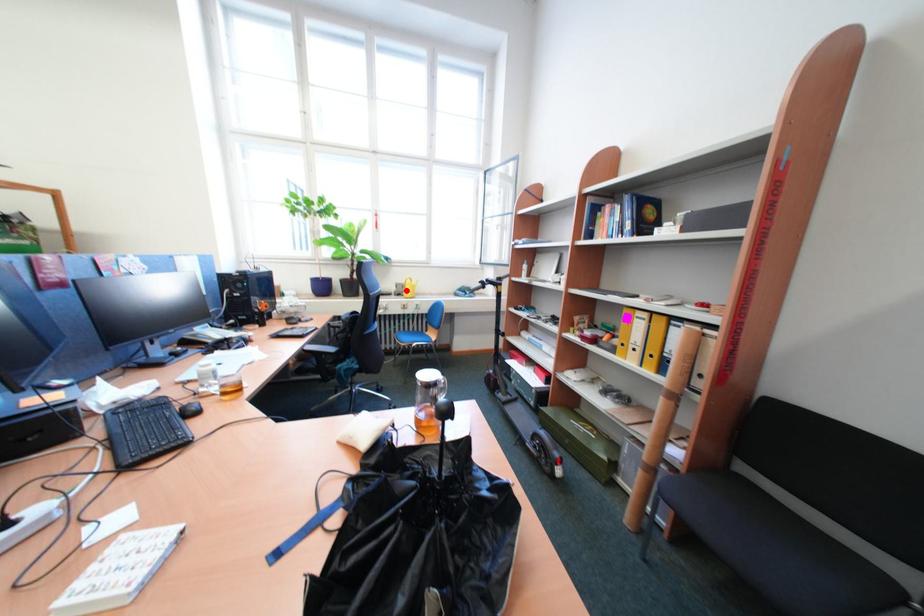
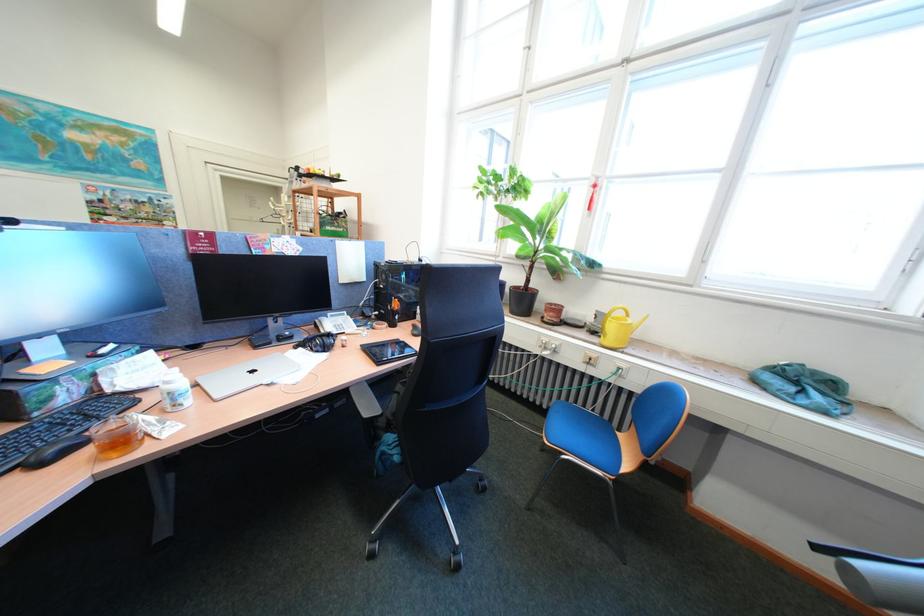
The point at the highlighted location is marked in the first image. Where is the corresponding point in the second image?

(602, 321)